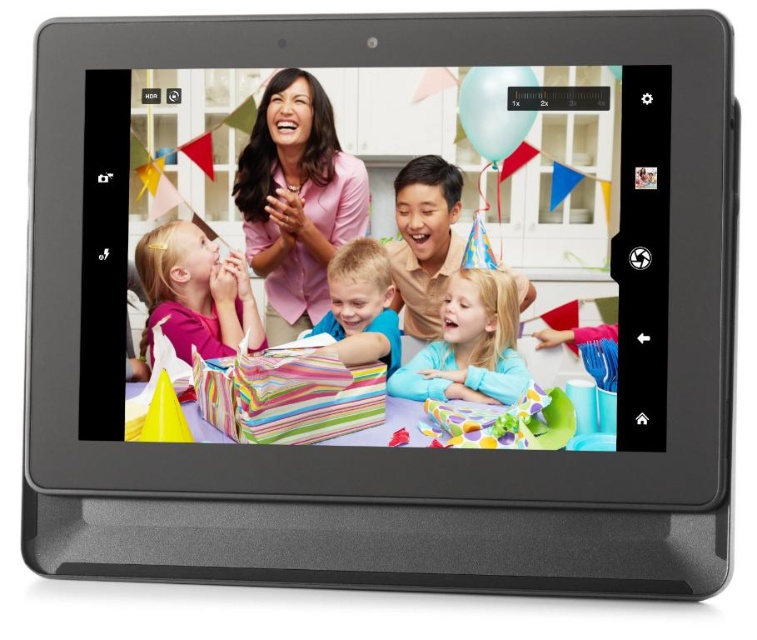
Question: Does pastel blue fabric at center have a smaller size compared to smooth blonde hair at center?

Choices:
 (A) no
 (B) yes

Answer: (A)

Question: In this image, where is pink matte shirt at center located relative to pastel blue fabric at center?

Choices:
 (A) below
 (B) above

Answer: (B)

Question: Which is farther from the pastel blue fabric at center?

Choices:
 (A) pink matte shirt at center
 (B) smooth blonde hair at center

Answer: (A)

Question: Estimate the real-world distances between objects in this image. Which object is farther from the pastel blue fabric at center?

Choices:
 (A) smooth blonde hair at center
 (B) pink matte shirt at center

Answer: (B)

Question: Is pink matte shirt at center below pastel blue fabric at center?

Choices:
 (A) no
 (B) yes

Answer: (A)

Question: Which point is closer to the camera taking this photo?

Choices:
 (A) (441, 371)
 (B) (181, 224)
 (C) (343, 349)

Answer: (B)